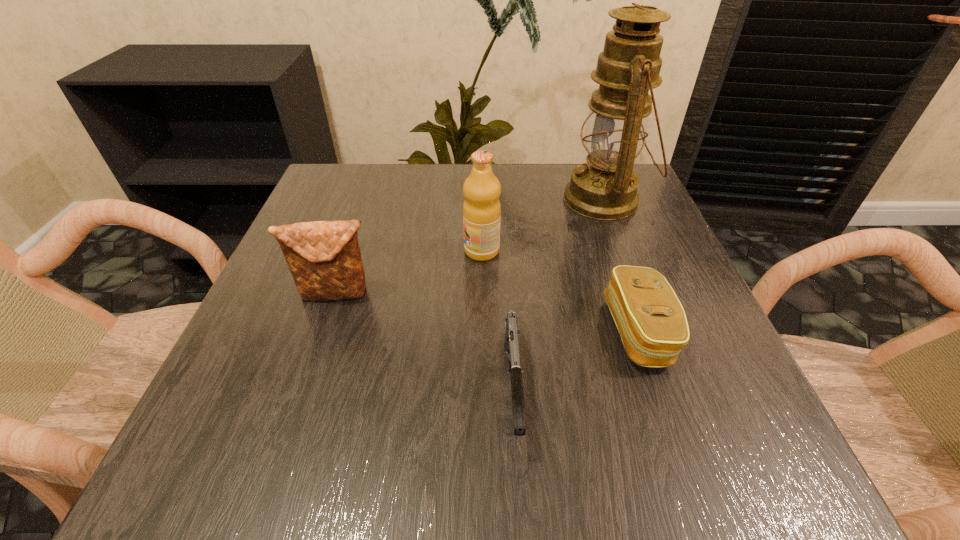
Locate an element on the screen. Image resolution: width=960 pixels, height=540 pixels. oil lamp is located at coordinates (604, 188).

What are the coordinates of `the tallest object` in the screenshot? It's located at (604, 188).

Locate an element on the screen. This screenshot has height=540, width=960. the second tallest object is located at coordinates (481, 210).

In order to click on the fourth nearest object in this screenshot , I will do `click(481, 210)`.

You are a GUI agent. You are given a task and a screenshot of the screen. Output one action in this format:
    pyautogui.click(x=<x>, y=<y>)
    Task: Click on the leftmost object
    
    Given the screenshot: What is the action you would take?
    pyautogui.click(x=324, y=258)

This screenshot has height=540, width=960. What are the coordinates of `the third shortest object` in the screenshot? It's located at (324, 258).

Image resolution: width=960 pixels, height=540 pixels. I want to click on the shorter clutch bag, so click(x=651, y=321).

Image resolution: width=960 pixels, height=540 pixels. I want to click on gun, so click(x=512, y=332).

Find the location of a particular element. free region located 0.390m on the left of the oil lamp is located at coordinates (396, 199).

Identify the location of vacant area situated 0.270m on the front label of the fruit juice. The image size is (960, 540). (330, 251).